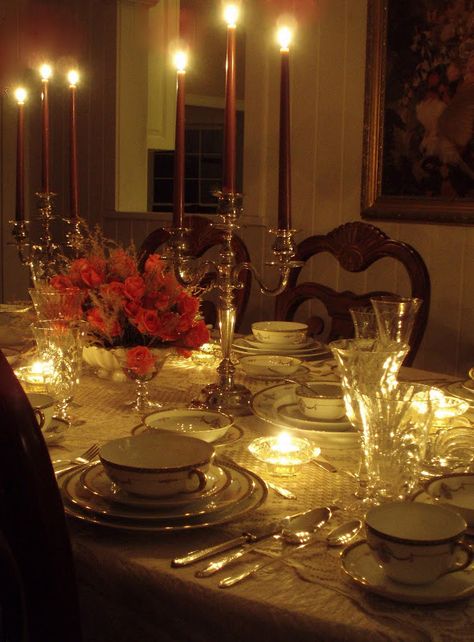
Where is `bowl`? bowl is located at coordinates pyautogui.click(x=148, y=465), pyautogui.click(x=193, y=426), pyautogui.click(x=279, y=333), pyautogui.click(x=264, y=367), pyautogui.click(x=321, y=404), pyautogui.click(x=452, y=499), pyautogui.click(x=428, y=533).